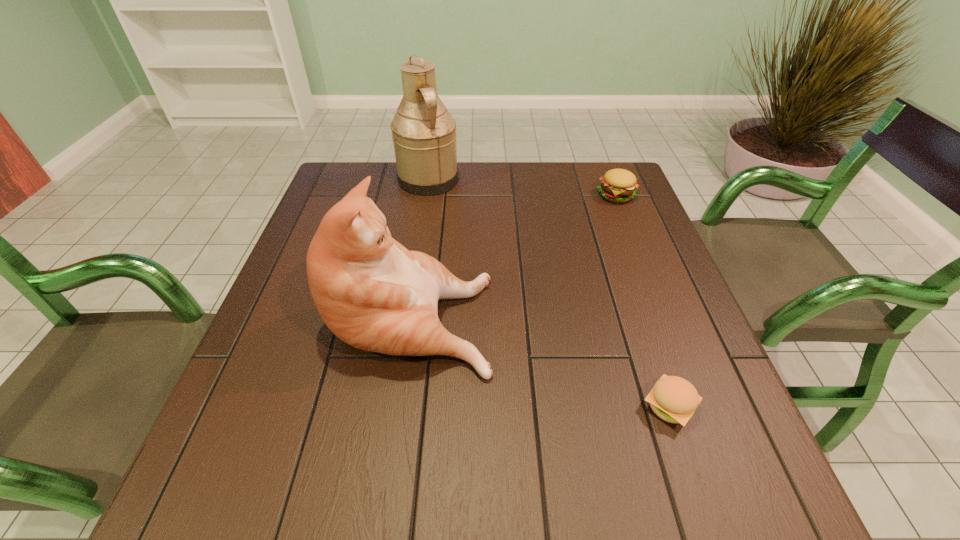
Locate an element on the screen. The height and width of the screenshot is (540, 960). pitcher is located at coordinates (424, 135).

Locate an element on the screen. Image resolution: width=960 pixels, height=540 pixels. cat is located at coordinates (374, 294).

Locate an element on the screen. The height and width of the screenshot is (540, 960). the farther hamburger is located at coordinates (617, 185).

I want to click on the shorter hamburger, so click(673, 399).

I want to click on the nearer hamburger, so click(x=673, y=399).

Image resolution: width=960 pixels, height=540 pixels. I want to click on free space located on the right of the pitcher, so click(x=485, y=180).

At what (x,y) coordinates should I click in order to perform the action: click on free spot located on the face of the cat. Please return your answer as a coordinate pair (x, y). The image size is (960, 540). Looking at the image, I should click on (660, 313).

Image resolution: width=960 pixels, height=540 pixels. What are the coordinates of `blank space located 0.400m on the front of the farther hamburger` in the screenshot? It's located at (663, 313).

Where is `free space located on the back of the shortest object`? This screenshot has height=540, width=960. free space located on the back of the shortest object is located at coordinates (630, 290).

Locate an element on the screen. pitcher at the far edge is located at coordinates (424, 135).